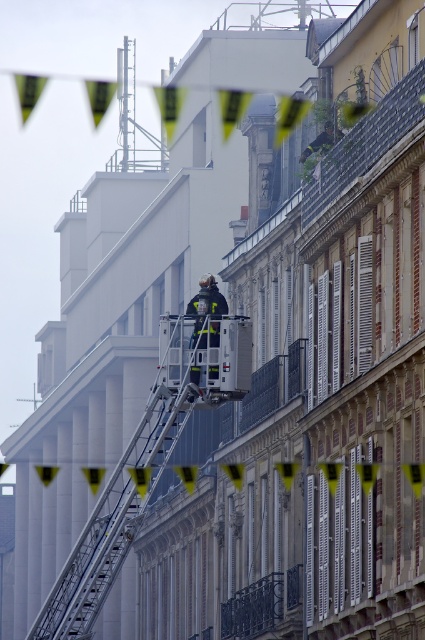
Does metallic silver ladder at center have a lesser width compared to reflective silver fireman at center?

Incorrect, metallic silver ladder at center's width is not less than reflective silver fireman at center's.

Does metallic silver ladder at center appear under reflective silver fireman at center?

Yes.

Find the location of `metallic silver ladder at center`. metallic silver ladder at center is located at coordinates (127, 488).